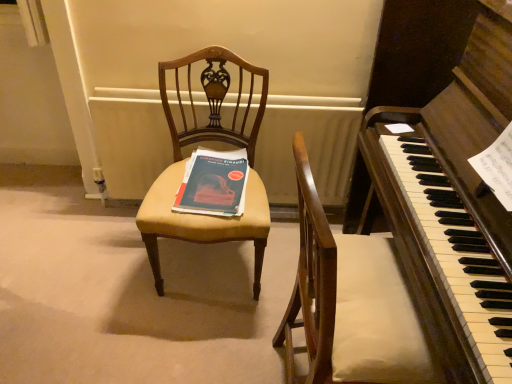
This screenshot has height=384, width=512. In order to click on free spot in front of matte yellow fabric chair at center in this screenshot , I will do `click(178, 342)`.